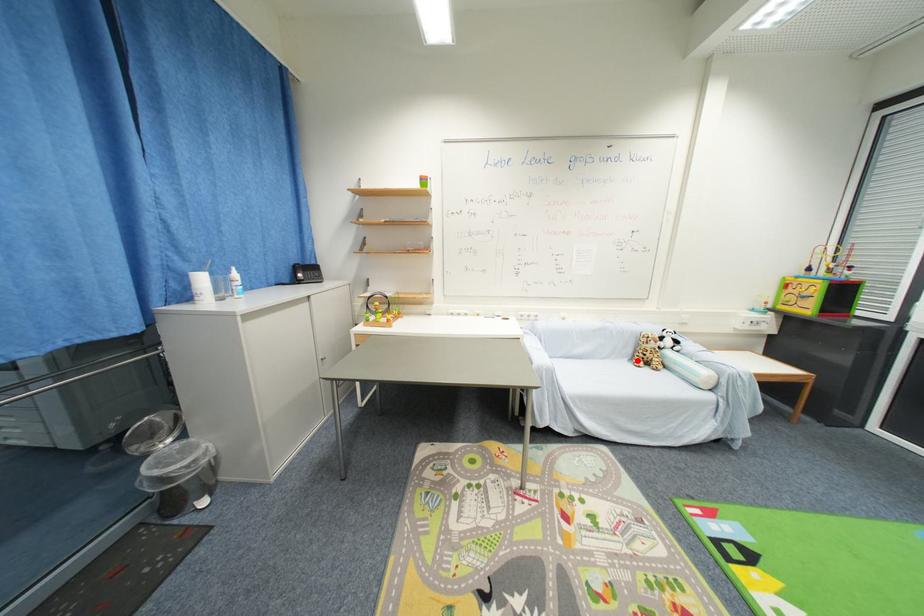
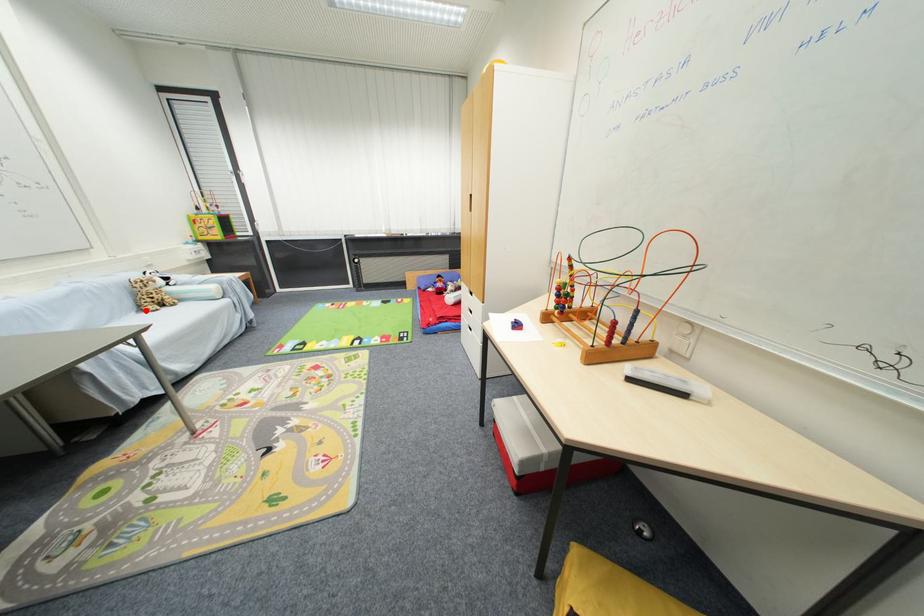
I am providing you with two images of the same scene from different viewpoints. A red point is marked on the first image and another point is marked on the second image. Is the marked point in image1 the same physical position as the marked point in image2?

Yes